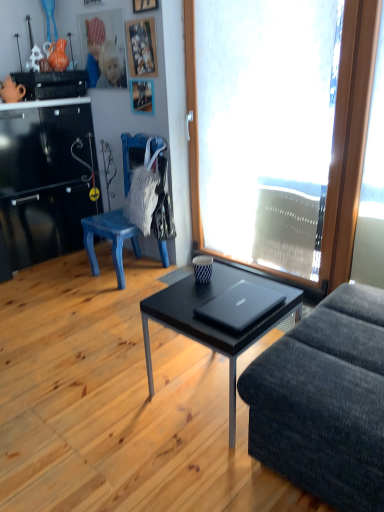
Locate an element on the screen. free space in front of blue and white ceramic cup at center is located at coordinates (210, 289).